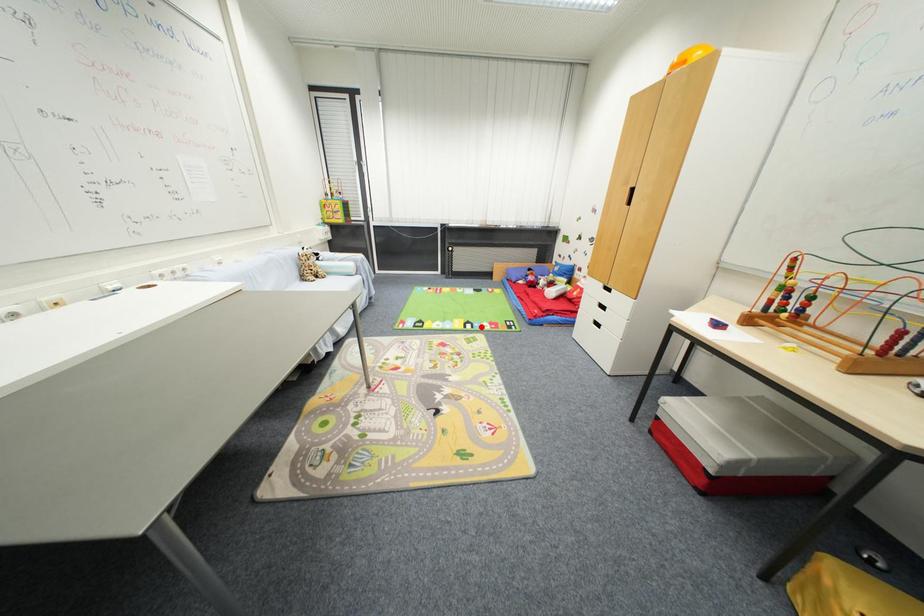
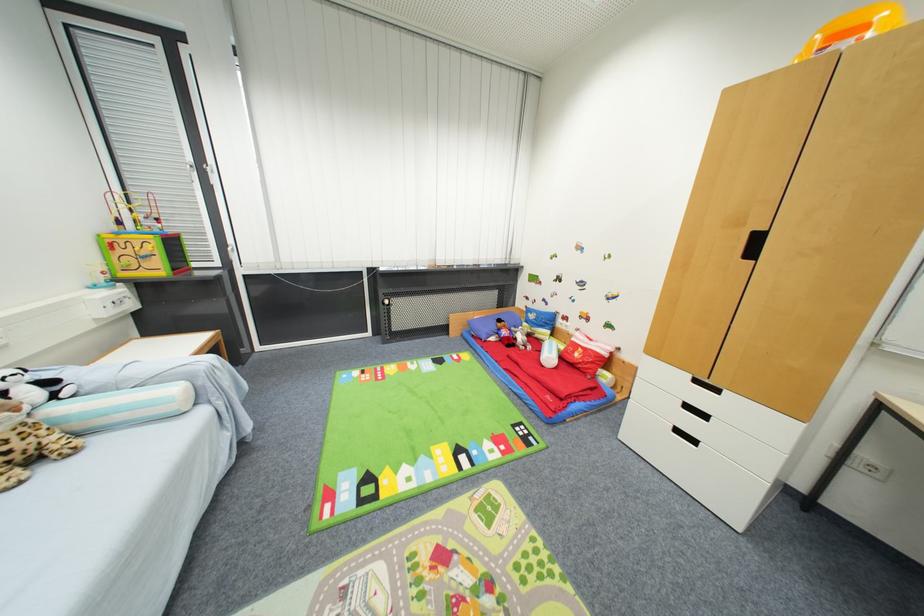
Question: I am providing you with two images of the same scene from different viewpoints. A red point is marked on the first image. Can you still see the location of the red point in image 2?

Choices:
 (A) Yes
 (B) No

Answer: (A)